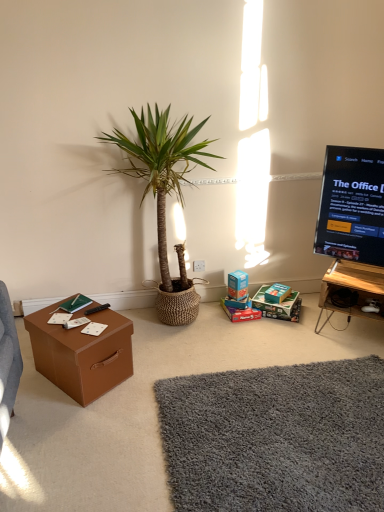
The height and width of the screenshot is (512, 384). In order to click on free space behind shaggy gray rug at lower center, which is the first plain in back-to-front order in this screenshot , I will do `click(238, 341)`.